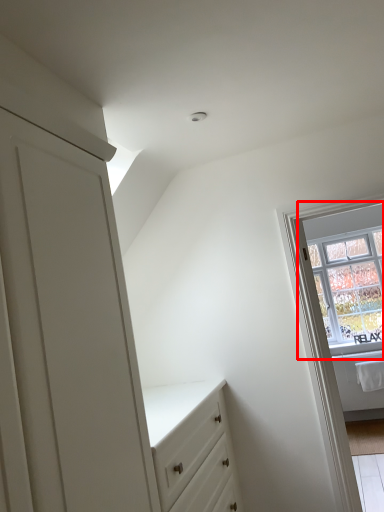
Question: From the image's perspective, what is the correct spatial relationship of window (annotated by the red box) in relation to window frame?

Choices:
 (A) below
 (B) above

Answer: (B)